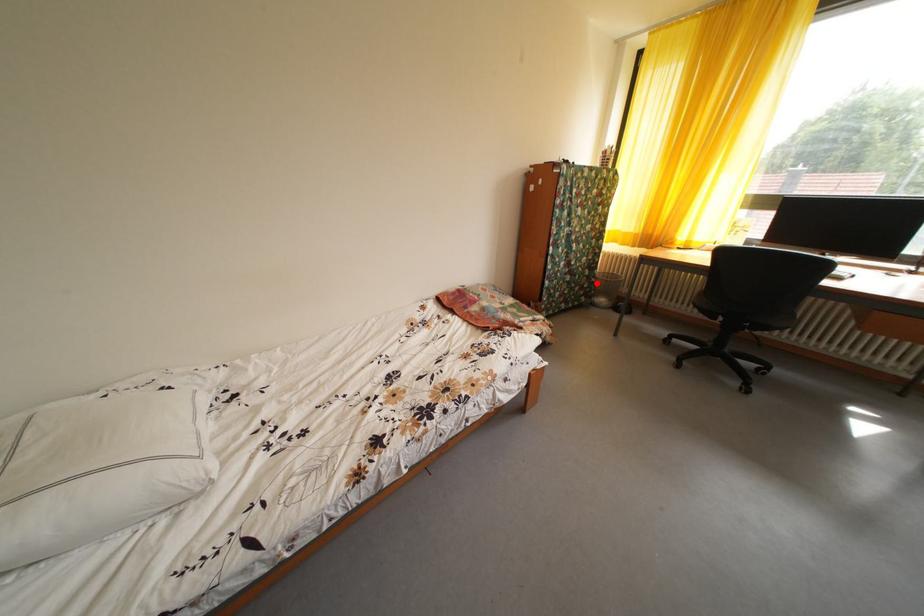
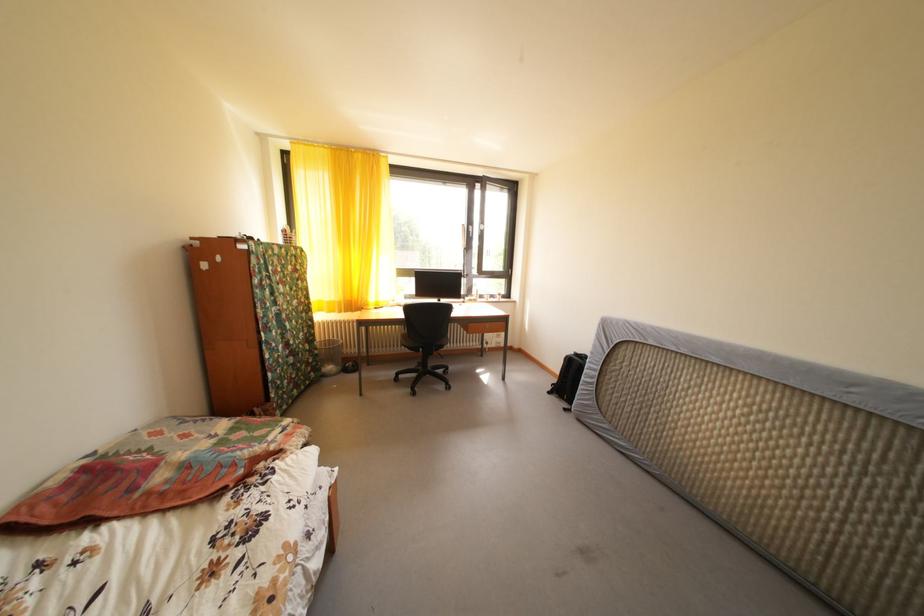
Question: A red point is marked in image1. In image2, is the corresponding 3D point closer to the camera or farther? Reply with the corresponding letter.

Choices:
 (A) The corresponding 3D point is closer.
 (B) The corresponding 3D point is farther.

Answer: (A)